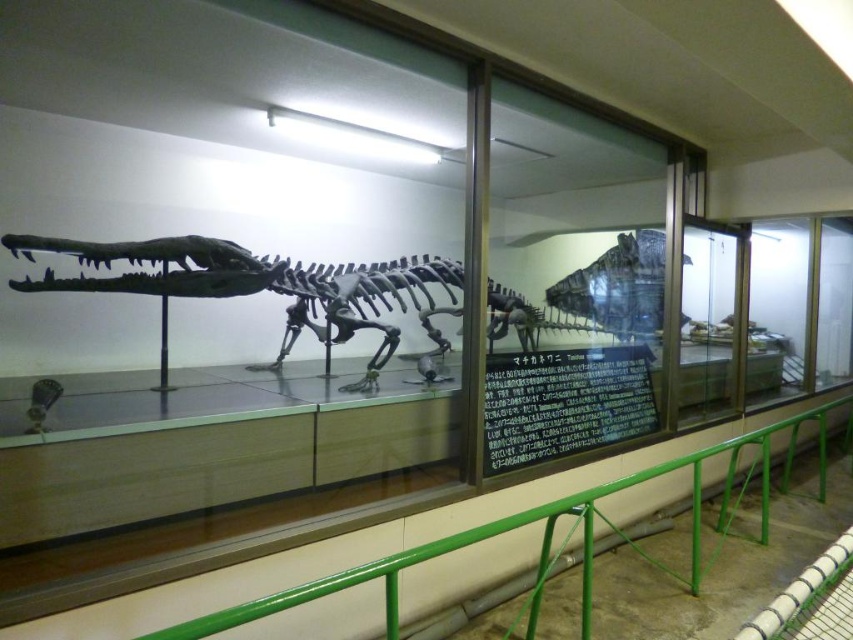
Question: Can you confirm if green metal railing at lower center is thinner than shiny metallic dinosaur skeleton at center?

Choices:
 (A) no
 (B) yes

Answer: (A)

Question: Can you confirm if black matte signboard at center is positioned to the right of shiny metallic dinosaur skeleton at center?

Choices:
 (A) no
 (B) yes

Answer: (A)

Question: Is black matte signboard at center below green metal railing at lower center?

Choices:
 (A) no
 (B) yes

Answer: (A)

Question: Which object is closer to the camera taking this photo?

Choices:
 (A) green metal railing at lower center
 (B) black matte signboard at center

Answer: (A)

Question: Which point is closer to the camera taking this photo?

Choices:
 (A) (585, 266)
 (B) (495, 380)

Answer: (B)

Question: Which object appears farthest from the camera in this image?

Choices:
 (A) shiny metallic dinosaur skeleton at center
 (B) green metal railing at lower center

Answer: (A)